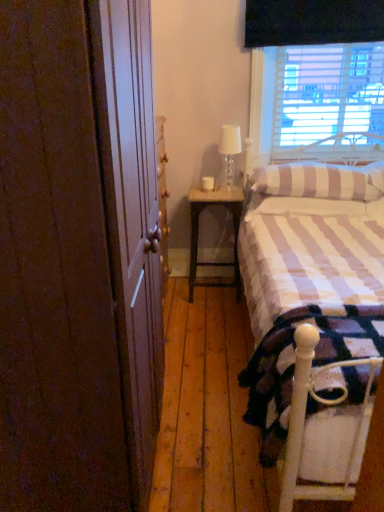
Question: Could you tell me if striped fabric pillow at upper right is facing white metal bed frame at lower right?

Choices:
 (A) yes
 (B) no

Answer: (B)

Question: From a real-world perspective, is striped fabric pillow at upper right below white metal bed frame at lower right?

Choices:
 (A) no
 (B) yes

Answer: (A)

Question: Considering the relative positions of striped fabric pillow at upper right and white metal bed frame at lower right in the image provided, is striped fabric pillow at upper right to the right of white metal bed frame at lower right from the viewer's perspective?

Choices:
 (A) yes
 (B) no

Answer: (A)

Question: Does striped fabric pillow at upper right have a greater width compared to white metal bed frame at lower right?

Choices:
 (A) no
 (B) yes

Answer: (B)

Question: Is striped fabric pillow at upper right to the left of white metal bed frame at lower right from the viewer's perspective?

Choices:
 (A) no
 (B) yes

Answer: (A)

Question: In terms of size, does white metal bed frame at lower right appear bigger or smaller than brown wood screen door at left?

Choices:
 (A) big
 (B) small

Answer: (B)

Question: Choose the correct answer: Is white metal bed frame at lower right inside brown wood screen door at left or outside it?

Choices:
 (A) inside
 (B) outside

Answer: (B)

Question: Is white metal bed frame at lower right to the left or to the right of brown wood screen door at left in the image?

Choices:
 (A) left
 (B) right

Answer: (B)

Question: Is white metal bed frame at lower right in front of or behind brown wood screen door at left in the image?

Choices:
 (A) behind
 (B) front

Answer: (A)

Question: From the image's perspective, relative to translucent glass table lamp at upper right, is striped fabric pillow at upper right above or below?

Choices:
 (A) above
 (B) below

Answer: (B)

Question: Considering the positions of striped fabric pillow at upper right and translucent glass table lamp at upper right in the image, is striped fabric pillow at upper right bigger or smaller than translucent glass table lamp at upper right?

Choices:
 (A) small
 (B) big

Answer: (B)

Question: Visually, is striped fabric pillow at upper right positioned to the left or to the right of translucent glass table lamp at upper right?

Choices:
 (A) left
 (B) right

Answer: (B)

Question: From a real-world perspective, is striped fabric pillow at upper right above or below translucent glass table lamp at upper right?

Choices:
 (A) above
 (B) below

Answer: (B)

Question: From a real-world perspective, is white metal bed frame at lower right above or below wooden nightstand at center?

Choices:
 (A) above
 (B) below

Answer: (A)

Question: Is white metal bed frame at lower right bigger or smaller than wooden nightstand at center?

Choices:
 (A) big
 (B) small

Answer: (A)